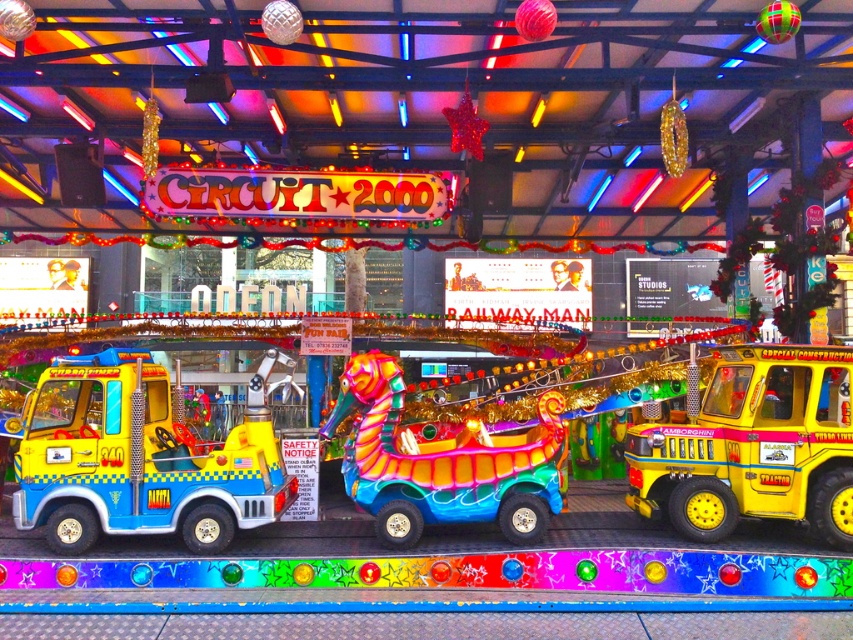
Question: Is the position of yellow matte tow truck at left less distant than that of shiny metallic seahorse at center?

Choices:
 (A) yes
 (B) no

Answer: (A)

Question: Which object is the farthest from the yellow matte construction vehicle at right?

Choices:
 (A) shiny metallic seahorse at center
 (B) yellow matte tow truck at left

Answer: (B)

Question: In this image, where is yellow matte construction vehicle at right located relative to shiny metallic seahorse at center?

Choices:
 (A) right
 (B) left

Answer: (A)

Question: Which object is farther from the camera taking this photo?

Choices:
 (A) yellow matte tow truck at left
 (B) yellow matte construction vehicle at right

Answer: (A)

Question: From the image, what is the correct spatial relationship of yellow matte tow truck at left in relation to shiny metallic seahorse at center?

Choices:
 (A) below
 (B) above

Answer: (B)

Question: Which point is farther to the camera?

Choices:
 (A) yellow matte construction vehicle at right
 (B) yellow matte tow truck at left
 (C) shiny metallic seahorse at center

Answer: (C)